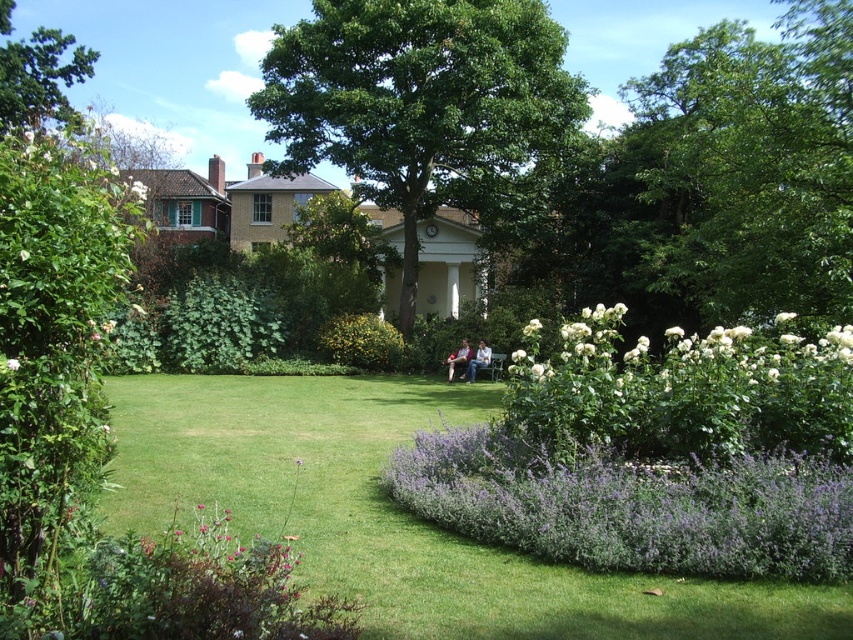
Does purple leafy bush at lower center have a greater width compared to white matte flower at center?

Indeed, purple leafy bush at lower center has a greater width compared to white matte flower at center.

I want to click on purple leafy bush at lower center, so click(x=631, y=508).

Locate an element on the screen. purple leafy bush at lower center is located at coordinates (631, 508).

Is point (250, 516) behind point (514, 349)?

No.

Can you confirm if green grass at center is taller than white fluffy flowers at right?

In fact, green grass at center may be shorter than white fluffy flowers at right.

Describe the element at coordinates (399, 515) in the screenshot. I see `green grass at center` at that location.

Where is `green grass at center`? green grass at center is located at coordinates (399, 515).

Is light brown wooden bench at center thinner than light brown wooden chair at center?

Yes, light brown wooden bench at center is thinner than light brown wooden chair at center.

Who is more forward, [479,353] or [461,346]?

Point [479,353]

Locate an element on the screen. light brown wooden bench at center is located at coordinates (479, 360).